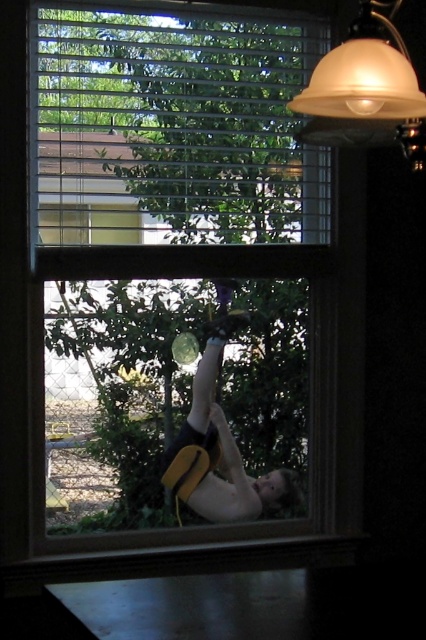
You are a painter who wants to capture the scene outside the window. You notice the green wood blinds at upper center and the matte white dome at upper right. Which object is closer to you as you stand at the window?

The green wood blinds at upper center are closer to you than the matte white dome at upper right because they are further to the viewer.

You are a delivery person trying to deliver a package to the matte white dome at upper right. You have a yellow fabric backpack at center that is blocking your path. Can you tell me if the backpack is wider than the dome so you can decide whether to move it?

The matte white dome at upper right is thinner than the yellow fabric backpack at center, so the backpack is wider. Therefore, you should move the yellow fabric backpack at center to access the matte white dome at upper right.